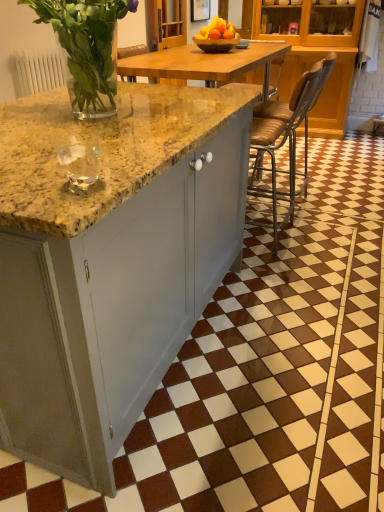
Where is `vacant region to the right of metallic brown bar stool at center`? vacant region to the right of metallic brown bar stool at center is located at coordinates (322, 238).